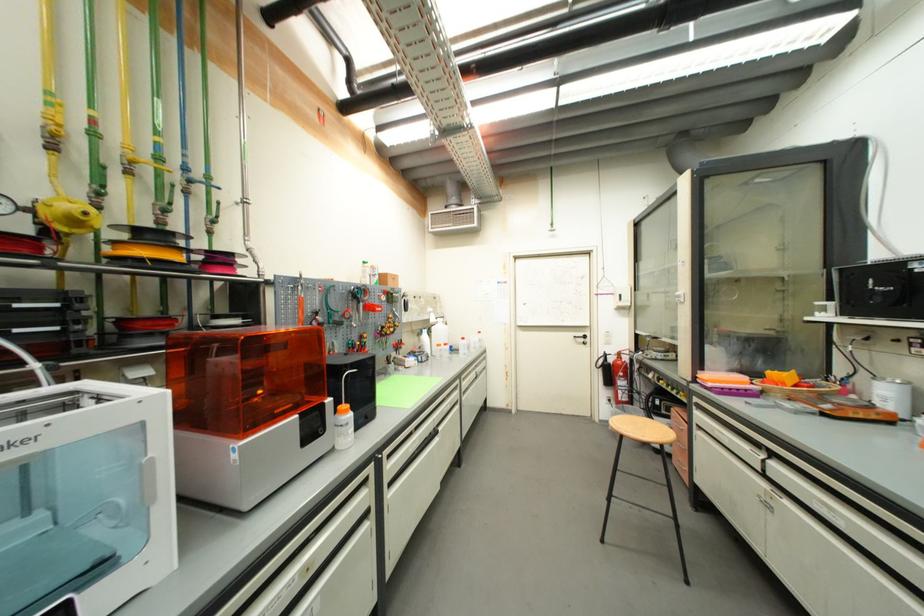
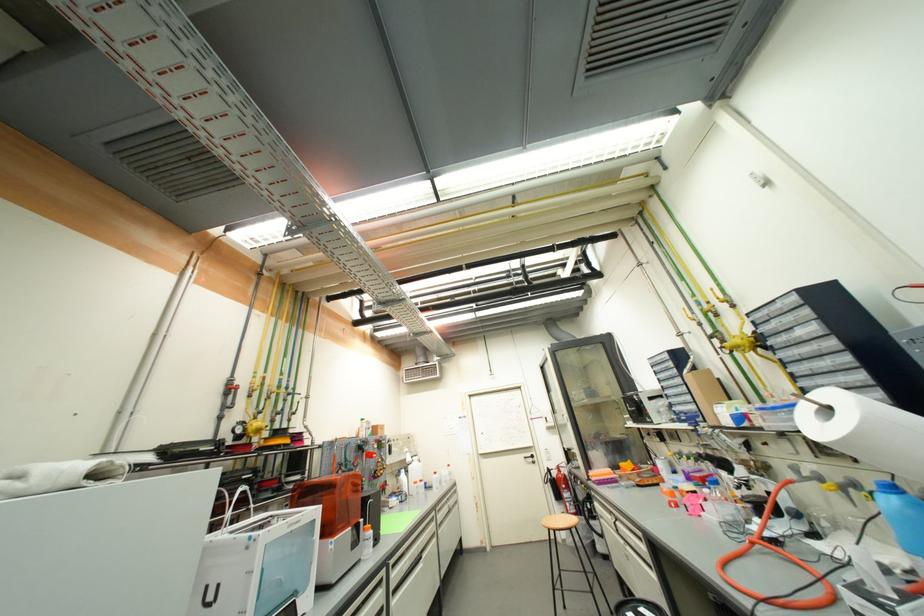
In the second image, find the point that corresponds to [434,322] in the first image.

(410, 461)